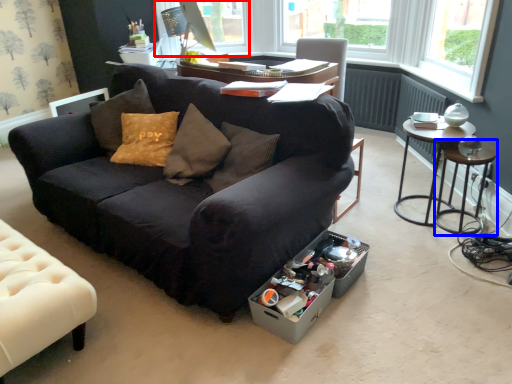
Question: Which point is further to the camera, window screen (highlighted by a red box) or side table (highlighted by a blue box)?

Choices:
 (A) window screen
 (B) side table

Answer: (A)